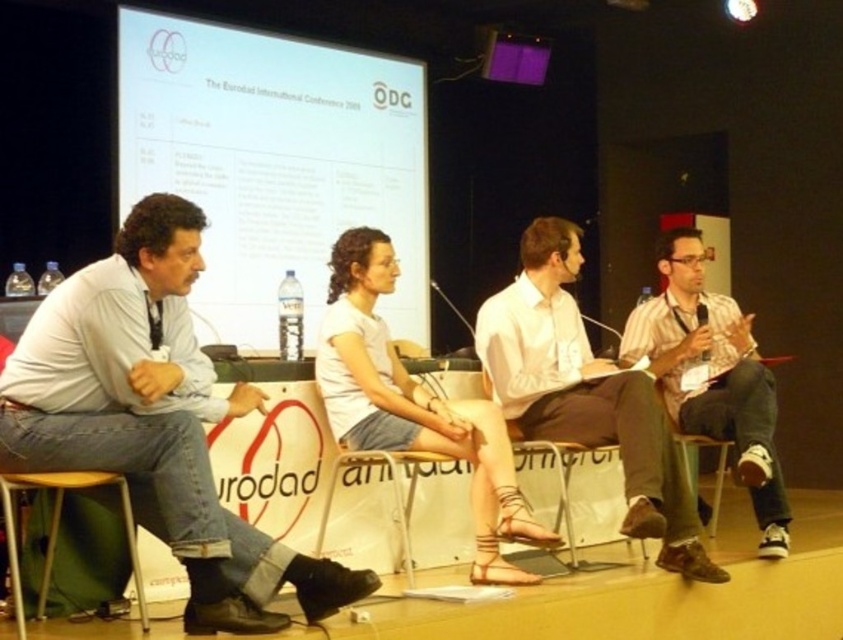
Consider the image. You are sitting in the audience and want to see both the white fabric skirt at center and the wooden at left. Which object will appear closer to you?

The white fabric skirt at center will appear closer to you because it is further to the viewer than the wooden at left.

You are an event organizer who needs to adjust the seating arrangement for better visibility. The white plastic chair at center is currently blocking the view of the white glossy projection screen at upper center. Can you move the chair to a position where it doesn not obstruct the screen?

The white glossy projection screen at upper center is positioned over the white plastic chair at center, so moving the chair slightly forward or backward could prevent it from blocking the screen.

You are sitting in the audience and want to take a photo of the panel discussion. You notice two points on the stage at coordinates point (185,83) and point (404,541). Which point will appear closer to the camera in your photo?

Point (185,83) is further to the camera than point (404,541), so the point (185,83) will appear closer to the camera in the photo.